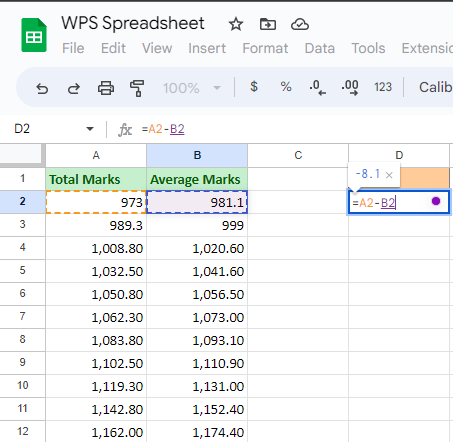
This screenshot has height=442, width=453. Identify the location of column. (105, 155), (188, 155), (302, 157), (405, 157).